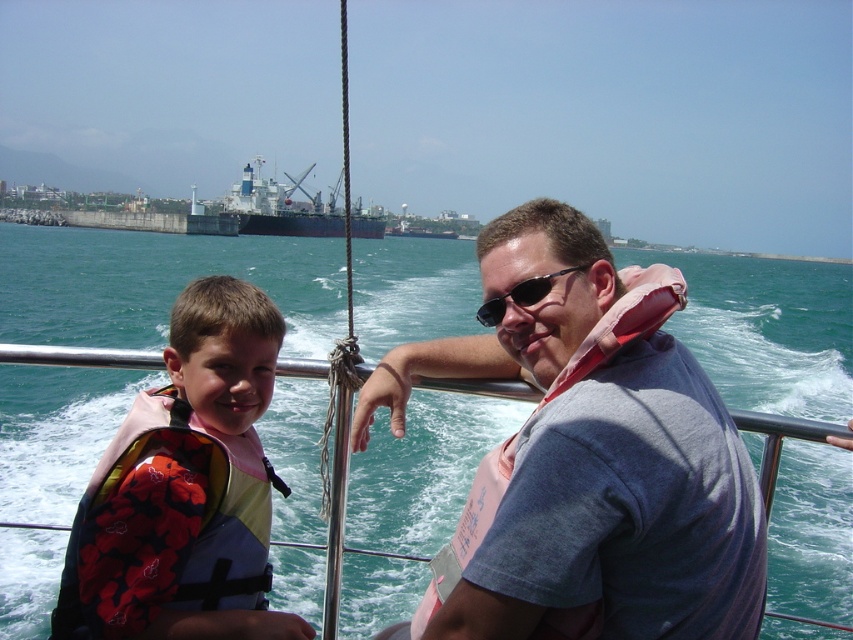
Question: Can you confirm if dark blue matte ship at center is wider than sunglasses at center?

Choices:
 (A) yes
 (B) no

Answer: (A)

Question: Which point is closer to the camera taking this photo?

Choices:
 (A) (575, 394)
 (B) (251, 348)
 (C) (282, 196)
 (D) (3, 532)

Answer: (A)

Question: Among these objects, which one is nearest to the camera?

Choices:
 (A) multicolored life vest at left
 (B) sunglasses at center
 (C) gray fabric life vest at right
 (D) dark blue matte ship at center

Answer: (C)

Question: Which object is farther from the camera taking this photo?

Choices:
 (A) dark blue matte ship at center
 (B) gray fabric life vest at right

Answer: (A)

Question: Is multicolored life vest at left further to camera compared to dark blue matte ship at center?

Choices:
 (A) yes
 (B) no

Answer: (B)

Question: Is blue water at center smaller than dark blue matte ship at center?

Choices:
 (A) no
 (B) yes

Answer: (A)